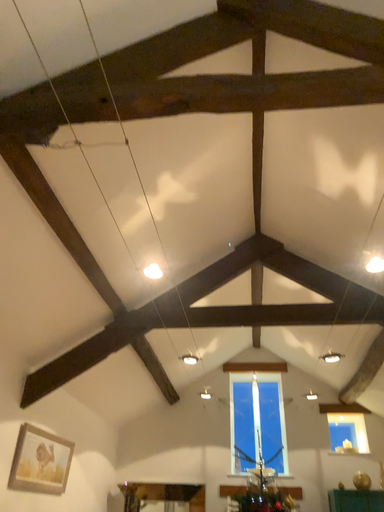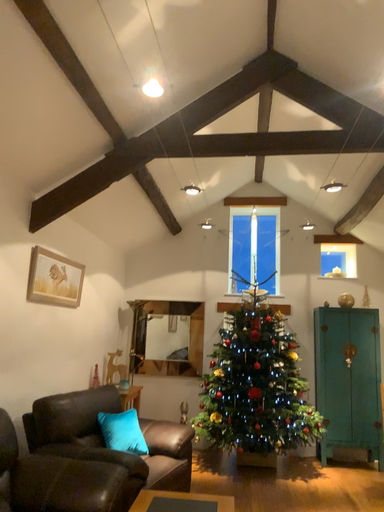
Question: Which way did the camera rotate in the video?

Choices:
 (A) rotated downward
 (B) rotated upward

Answer: (A)